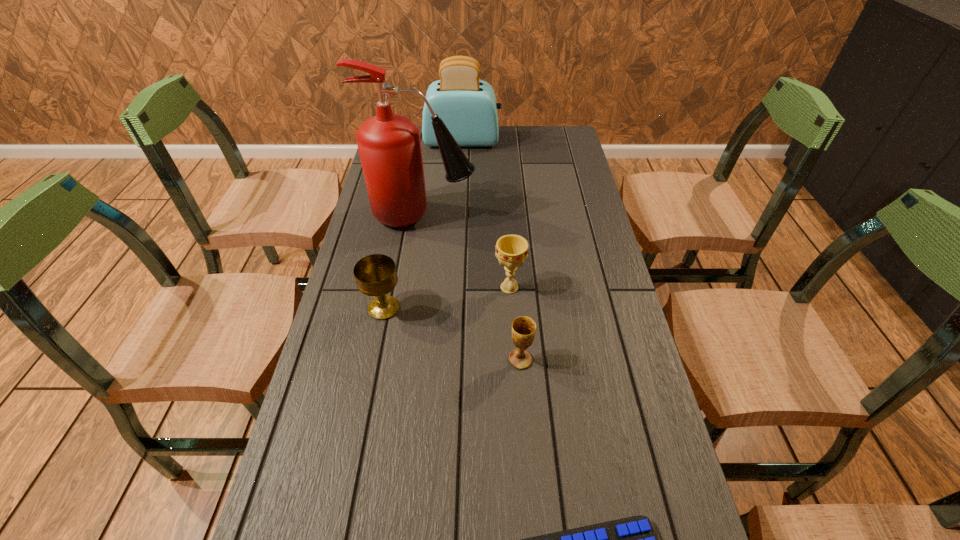
You are a GUI agent. You are given a task and a screenshot of the screen. Output one action in this format:
    pyautogui.click(x=<x>, y=<y>)
    Task: Click on the object that is at the far edge
    The width and height of the screenshot is (960, 540).
    Given the screenshot: What is the action you would take?
    pyautogui.click(x=467, y=106)

I want to click on fire extinguisher present at the left edge, so click(x=389, y=145).

Locate an element on the screen. The height and width of the screenshot is (540, 960). toaster that is at the left edge is located at coordinates (467, 106).

The height and width of the screenshot is (540, 960). Find the location of `chalice present at the left edge`. chalice present at the left edge is located at coordinates (375, 275).

Locate an element on the screen. The width and height of the screenshot is (960, 540). object that is at the far left corner is located at coordinates (467, 106).

The image size is (960, 540). In the image, there is a desktop. Identify the location of free space at the far edge. (521, 132).

In order to click on free space at the left edge of the desktop in this screenshot , I will do `click(298, 521)`.

The image size is (960, 540). I want to click on blank space at the right edge of the desktop, so click(x=609, y=368).

Find the location of a particular element. The height and width of the screenshot is (540, 960). vacant space at the far right corner of the desktop is located at coordinates (548, 134).

I want to click on empty space between the farthest object and the second farthest object, so click(443, 178).